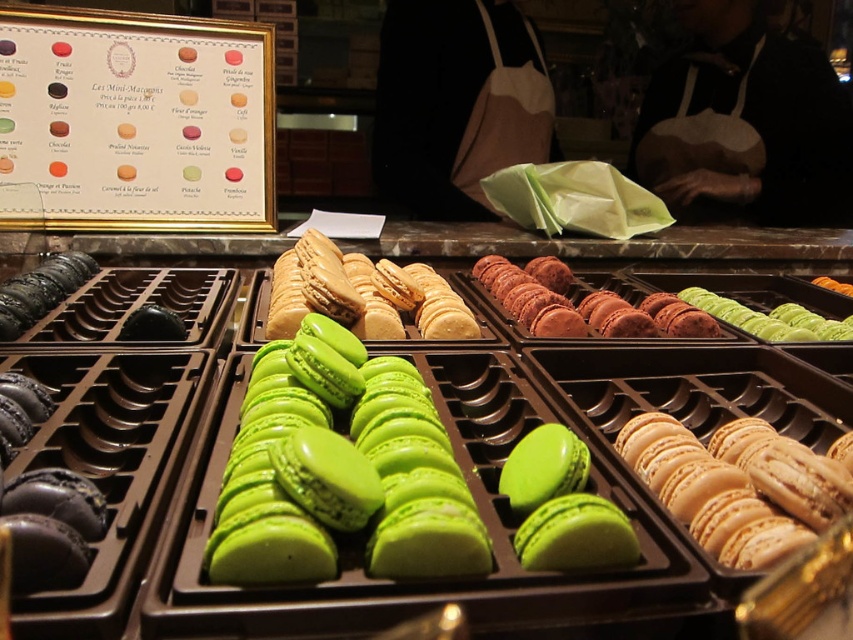
Consider the image. You are a customer at the bakery and want to know which macaron is taller between the green glossy macarons at center and the matte beige macarons at center right. Can you tell me based on their positions?

The green glossy macarons at center are taller than the matte beige macarons at center right.

You are a customer at a French bakery and want to buy the larger macaron between the green glossy macarons at center and the matte beige macarons at center right. Which one should you choose?

The green glossy macarons at center are bigger than the matte beige macarons at center right, so you should choose the green glossy macarons at center.